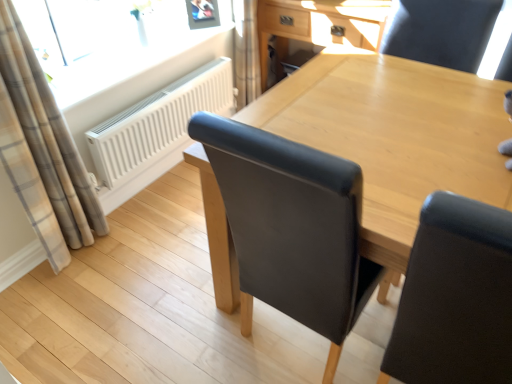
What is the approximate width of plaid fabric curtain at left?

It is 19.14 centimeters.

You are a GUI agent. You are given a task and a screenshot of the screen. Output one action in this format:
    pyautogui.click(x=<x>, y=<y>)
    Task: Click on the white matte radiator at upper left
    
    Given the screenshot: What is the action you would take?
    pyautogui.click(x=158, y=123)

What do you see at coordinates (455, 297) in the screenshot? This screenshot has width=512, height=384. I see `black leather chair at upper right` at bounding box center [455, 297].

The width and height of the screenshot is (512, 384). What do you see at coordinates (122, 44) in the screenshot?
I see `transparent glass window at upper left` at bounding box center [122, 44].

At what (x,y) coordinates should I click in order to perform the action: click on metallic silver picture frame at upper center. Please return your answer as a coordinate pair (x, y). The width and height of the screenshot is (512, 384). Looking at the image, I should click on (202, 13).

Locate an element on the screen. plaid fabric curtain at left is located at coordinates (42, 151).

Is white matte radiator at upper left bigger or smaller than light wood/texture computer desk at upper center?

Clearly, white matte radiator at upper left is smaller in size than light wood/texture computer desk at upper center.

Would you say white matte radiator at upper left contains light wood/texture computer desk at upper center?

No.

Where is `computer desk located behind the white matte radiator at upper left`? This screenshot has height=384, width=512. computer desk located behind the white matte radiator at upper left is located at coordinates (319, 24).

From a real-world perspective, is white matte radiator at upper left physically above light wood/texture computer desk at upper center?

Incorrect, from a real-world perspective, white matte radiator at upper left is lower than light wood/texture computer desk at upper center.

What's the angular difference between metallic silver picture frame at upper center and white matte radiator at upper left's facing directions?

metallic silver picture frame at upper center and white matte radiator at upper left are facing 37.8 degrees away from each other.

Where is `picture frame on the right of the white matte radiator at upper left`? picture frame on the right of the white matte radiator at upper left is located at coordinates (202, 13).

Is metallic silver picture frame at upper center situated inside white matte radiator at upper left or outside?

metallic silver picture frame at upper center is not enclosed by white matte radiator at upper left.

Is plaid fabric curtain at left to the right of light wood/texture computer desk at upper center from the viewer's perspective?

No, plaid fabric curtain at left is not to the right of light wood/texture computer desk at upper center.

Does plaid fabric curtain at left have a greater width compared to light wood/texture computer desk at upper center?

Incorrect, the width of plaid fabric curtain at left does not surpass that of light wood/texture computer desk at upper center.

Does plaid fabric curtain at left have a larger size compared to light wood/texture computer desk at upper center?

Incorrect, plaid fabric curtain at left is not larger than light wood/texture computer desk at upper center.

From a real-world perspective, who is located lower, plaid fabric curtain at left or light wood/texture computer desk at upper center?

light wood/texture computer desk at upper center is physically lower.

In the scene shown: From a real-world perspective, does white matte radiator at upper left stand above light brown wood table at center?

Actually, white matte radiator at upper left is physically below light brown wood table at center in the real world.

Is white matte radiator at upper left shorter than light brown wood table at center?

Yes.

Is white matte radiator at upper left bigger than light brown wood table at center?

Incorrect, white matte radiator at upper left is not larger than light brown wood table at center.

From the image's perspective, would you say white matte radiator at upper left is shown under light brown wood table at center?

No, from the image's perspective, white matte radiator at upper left is not below light brown wood table at center.

Considering the relative sizes of plaid fabric curtain at left and white matte radiator at upper left in the image provided, is plaid fabric curtain at left thinner than white matte radiator at upper left?

No, plaid fabric curtain at left is not thinner than white matte radiator at upper left.

Is white matte radiator at upper left located within plaid fabric curtain at left?

Definitely not — white matte radiator at upper left is not inside plaid fabric curtain at left.

Are plaid fabric curtain at left and white matte radiator at upper left located far from each other?

No, plaid fabric curtain at left is in close proximity to white matte radiator at upper left.

Considering the positions of objects plaid fabric curtain at left and white matte radiator at upper left in the image provided, who is more to the left, plaid fabric curtain at left or white matte radiator at upper left?

From the viewer's perspective, plaid fabric curtain at left appears more on the left side.

From the image's perspective, which is above, black leather chair at upper right or metallic silver picture frame at upper center?

metallic silver picture frame at upper center, from the image's perspective.

Based on their positions, is black leather chair at upper right located to the left or right of metallic silver picture frame at upper center?

Based on their positions, black leather chair at upper right is located to the right of metallic silver picture frame at upper center.

Locate an element on the screen. The width and height of the screenshot is (512, 384). chair in front of the metallic silver picture frame at upper center is located at coordinates (455, 297).

Choose the correct answer: Is black leather chair at upper right inside white matte radiator at upper left or outside it?

The correct answer is: outside.

Considering the relative positions of black leather chair at upper right and white matte radiator at upper left in the image provided, is black leather chair at upper right to the right of white matte radiator at upper left from the viewer's perspective?

Yes.

In terms of size, does black leather chair at upper right appear bigger or smaller than white matte radiator at upper left?

Considering their sizes, black leather chair at upper right takes up more space than white matte radiator at upper left.

The height and width of the screenshot is (384, 512). In order to click on radiator below the light wood/texture computer desk at upper center (from a real-world perspective) in this screenshot , I will do `click(158, 123)`.

At what (x,y) coordinates should I click in order to perform the action: click on picture frame above the white matte radiator at upper left (from a real-world perspective). Please return your answer as a coordinate pair (x, y). The image size is (512, 384). Looking at the image, I should click on (202, 13).

From the image, which object appears to be nearer to black leather chair at upper right, transparent glass window at upper left or light wood/texture computer desk at upper center?

light wood/texture computer desk at upper center is positioned closer to the anchor black leather chair at upper right.

From the picture: Which object lies nearer to the anchor point metallic silver picture frame at upper center, light wood/texture computer desk at upper center or light brown wood table at center?

light wood/texture computer desk at upper center lies closer to metallic silver picture frame at upper center than the other object.

Estimate the real-world distances between objects in this image. Which object is further from light wood/texture computer desk at upper center, black leather chair at upper right or light brown wood table at center?

Based on the image, black leather chair at upper right appears to be further to light wood/texture computer desk at upper center.

Considering their positions, is plaid fabric curtain at left positioned further to light brown wood table at center than metallic silver picture frame at upper center?

metallic silver picture frame at upper center.

Considering their positions, is white matte radiator at upper left positioned closer to light brown wood table at center than plaid fabric curtain at left?

white matte radiator at upper left is positioned closer to the anchor light brown wood table at center.

Based on the photo, looking at the image, which one is located closer to black leather chair at upper right, transparent glass window at upper left or light brown wood table at center?

Among the two, light brown wood table at center is located nearer to black leather chair at upper right.

Considering their positions, is light brown wood table at center positioned closer to transparent glass window at upper left than plaid fabric curtain at left?

Among the two, plaid fabric curtain at left is located nearer to transparent glass window at upper left.

Looking at the image, which one is located further to light wood/texture computer desk at upper center, light brown wood table at center or transparent glass window at upper left?

Based on the image, light brown wood table at center appears to be further to light wood/texture computer desk at upper center.

Locate an element on the screen. The height and width of the screenshot is (384, 512). picture frame between plaid fabric curtain at left and light wood/texture computer desk at upper center is located at coordinates (202, 13).

Where is `radiator between plaid fabric curtain at left and black leather chair at upper right from left to right`? The height and width of the screenshot is (384, 512). radiator between plaid fabric curtain at left and black leather chair at upper right from left to right is located at coordinates (158, 123).

Locate an element on the screen. Image resolution: width=512 pixels, height=384 pixels. curtain between black leather chair at upper right and metallic silver picture frame at upper center along the z-axis is located at coordinates (42, 151).

Where is `table between plaid fabric curtain at left and black leather chair at upper right from left to right`? This screenshot has width=512, height=384. table between plaid fabric curtain at left and black leather chair at upper right from left to right is located at coordinates (395, 136).